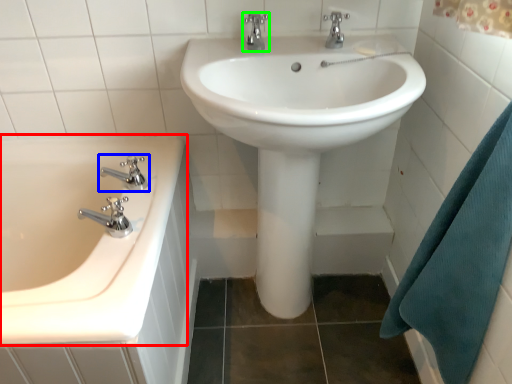
Question: Which is farther away from bathtub (highlighted by a red box)? tap (highlighted by a blue box) or tap (highlighted by a green box)?

Choices:
 (A) tap
 (B) tap

Answer: (B)